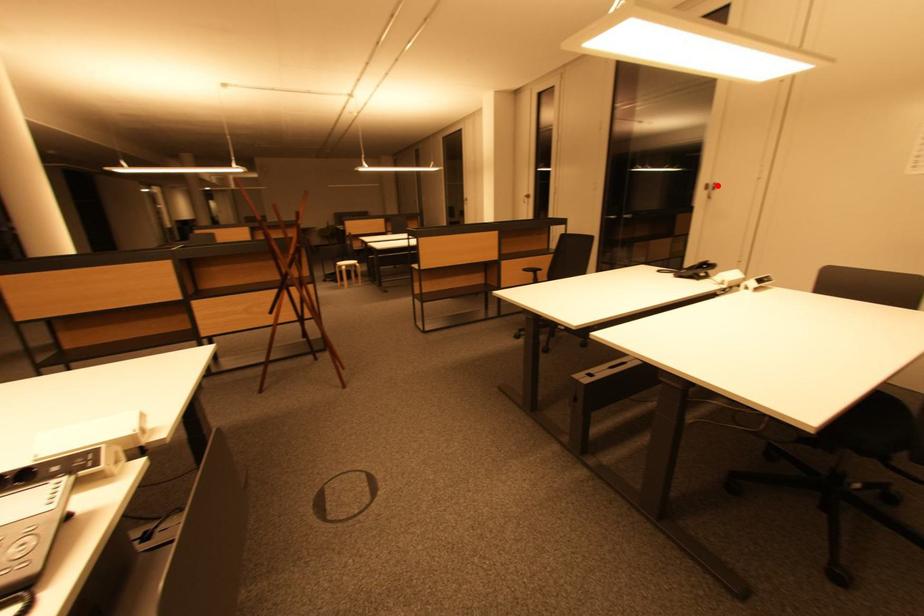
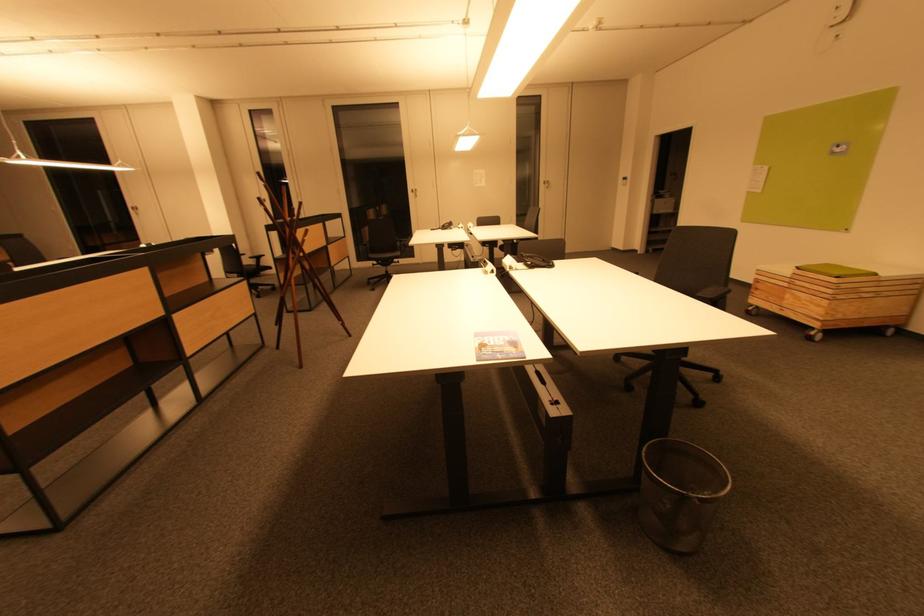
In the second image, find the point that corresponds to the highlighted location in the first image.

(419, 191)